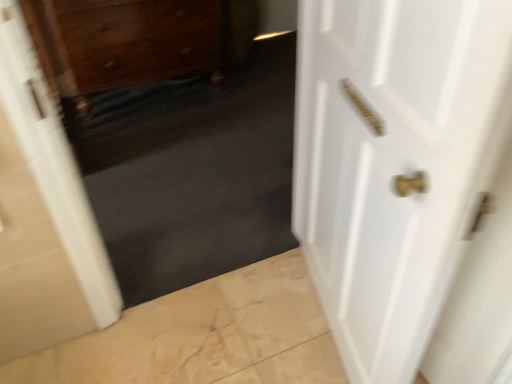
Question: Should I look upward or downward to see wooden drawer at upper left?

Choices:
 (A) up
 (B) down

Answer: (A)

Question: Would you say wooden drawer at upper left contains dark matte carpet at center?

Choices:
 (A) no
 (B) yes

Answer: (A)

Question: Does wooden drawer at upper left have a smaller size compared to dark matte carpet at center?

Choices:
 (A) no
 (B) yes

Answer: (A)

Question: From a real-world perspective, is wooden drawer at upper left on dark matte carpet at center?

Choices:
 (A) yes
 (B) no

Answer: (B)

Question: From a real-world perspective, does wooden drawer at upper left sit lower than dark matte carpet at center?

Choices:
 (A) no
 (B) yes

Answer: (B)

Question: Does wooden drawer at upper left have a larger size compared to dark matte carpet at center?

Choices:
 (A) no
 (B) yes

Answer: (B)

Question: Does wooden drawer at upper left come in front of dark matte carpet at center?

Choices:
 (A) no
 (B) yes

Answer: (A)

Question: Considering the relative sizes of wooden drawer at upper left and white glossy door at right in the image provided, is wooden drawer at upper left thinner than white glossy door at right?

Choices:
 (A) yes
 (B) no

Answer: (B)

Question: Is wooden drawer at upper left next to white glossy door at right and touching it?

Choices:
 (A) no
 (B) yes

Answer: (A)

Question: Considering the relative positions of wooden drawer at upper left and white glossy door at right in the image provided, is wooden drawer at upper left in front of white glossy door at right?

Choices:
 (A) yes
 (B) no

Answer: (B)

Question: Is wooden drawer at upper left oriented away from white glossy door at right?

Choices:
 (A) no
 (B) yes

Answer: (A)

Question: Does wooden drawer at upper left have a greater width compared to white glossy door at right?

Choices:
 (A) no
 (B) yes

Answer: (B)

Question: From the image's perspective, is wooden drawer at upper left below white glossy door at right?

Choices:
 (A) no
 (B) yes

Answer: (A)

Question: Is dark matte carpet at center to the right of wooden drawer at upper left from the viewer's perspective?

Choices:
 (A) yes
 (B) no

Answer: (A)